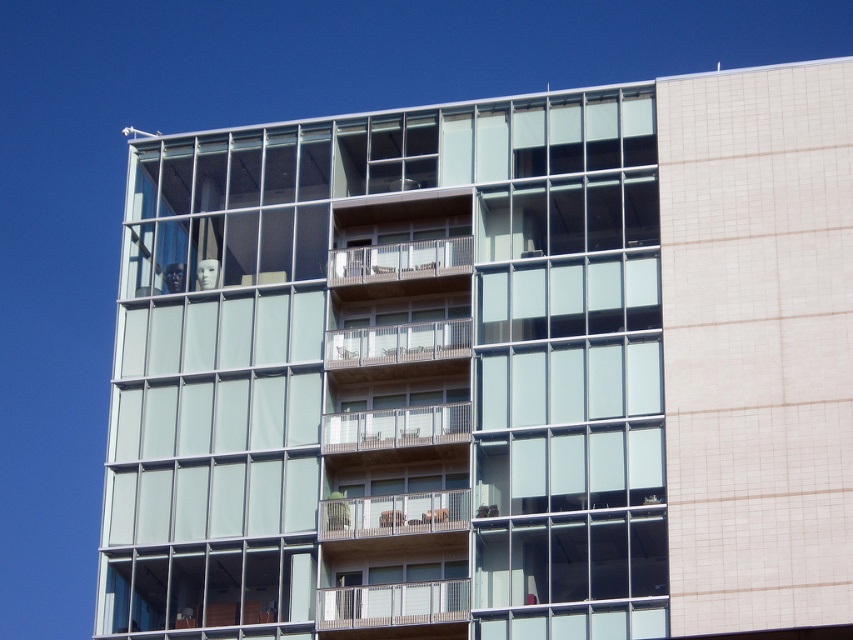
Question: Observing the image, what is the correct spatial positioning of clear glass windows at center in reference to wooden railing at lower center?

Choices:
 (A) above
 (B) below

Answer: (A)

Question: Which of the following is the farthest from the observer?

Choices:
 (A) wooden brown balcony at center
 (B) brown wooden balcony at center
 (C) wooden balcony at center

Answer: (B)

Question: Can you confirm if clear glass windows at center is wider than wooden balcony at center?

Choices:
 (A) no
 (B) yes

Answer: (B)

Question: Which point is farther to the camera?

Choices:
 (A) wooden at center
 (B) brown wooden balcony at center
 (C) wooden railing at lower center

Answer: (B)

Question: Among these objects, which one is nearest to the camera?

Choices:
 (A) clear glass windows at center
 (B) wooden railing at lower center
 (C) wooden brown balcony at center
 (D) brown wooden balcony at center

Answer: (A)

Question: Does wooden railing at lower center have a larger size compared to wooden at center?

Choices:
 (A) yes
 (B) no

Answer: (B)